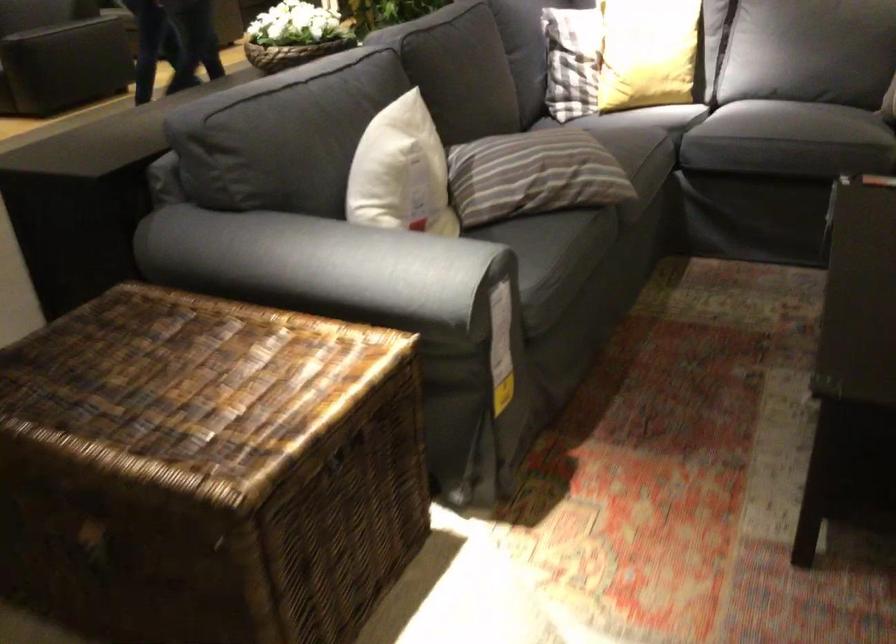
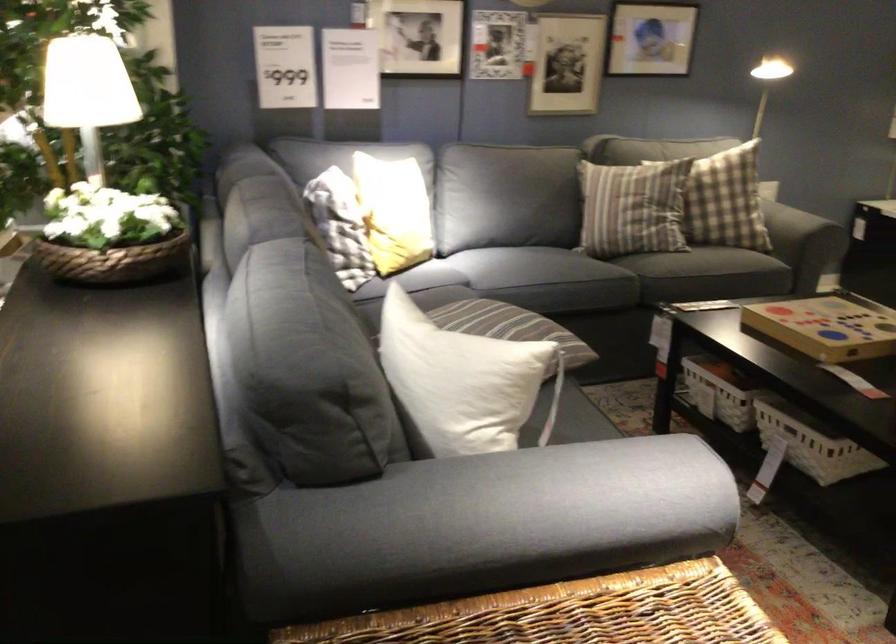
In the second image, find the point that corresponds to [325,283] in the first image.

(528, 500)